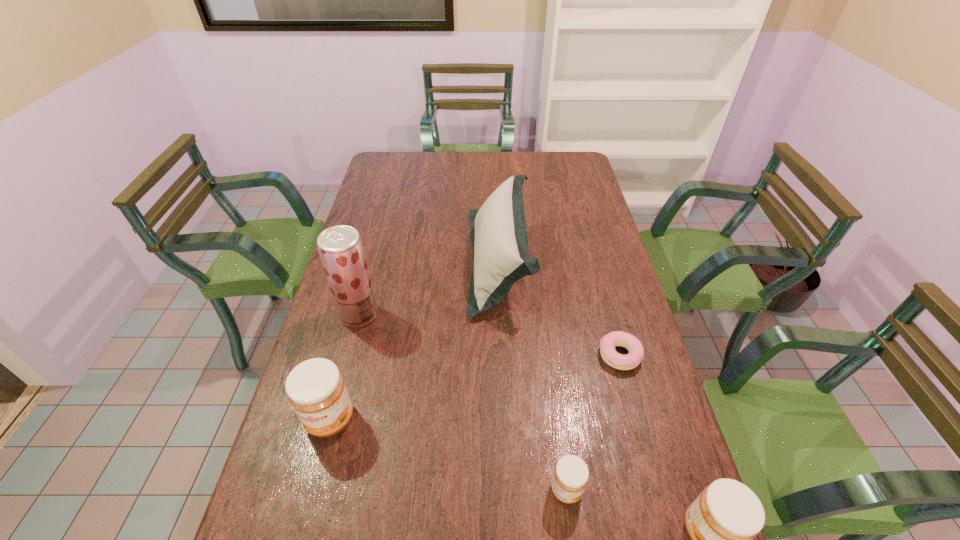
Where is `the leftmost jam`? This screenshot has width=960, height=540. the leftmost jam is located at coordinates (316, 390).

Where is `the third nearest object`? This screenshot has height=540, width=960. the third nearest object is located at coordinates (316, 390).

The height and width of the screenshot is (540, 960). I want to click on the fifth tallest object, so click(570, 477).

Locate an element on the screen. the second jam from right to left is located at coordinates (570, 477).

Find the location of `cushion`. cushion is located at coordinates (498, 231).

Find the location of a particular element. This screenshot has width=960, height=540. fruit juice is located at coordinates (340, 247).

At what (x,y) coordinates should I click in order to perform the action: click on the shortest object. Please return your answer as a coordinate pair (x, y). This screenshot has height=540, width=960. Looking at the image, I should click on (608, 343).

Where is `doughnut`? The width and height of the screenshot is (960, 540). doughnut is located at coordinates (608, 343).

Where is `vacant space located 0.130m on the front label of the fourth farthest object`? The height and width of the screenshot is (540, 960). vacant space located 0.130m on the front label of the fourth farthest object is located at coordinates (308, 501).

Identify the location of free space located 0.050m on the front label of the second shortest object. (605, 490).